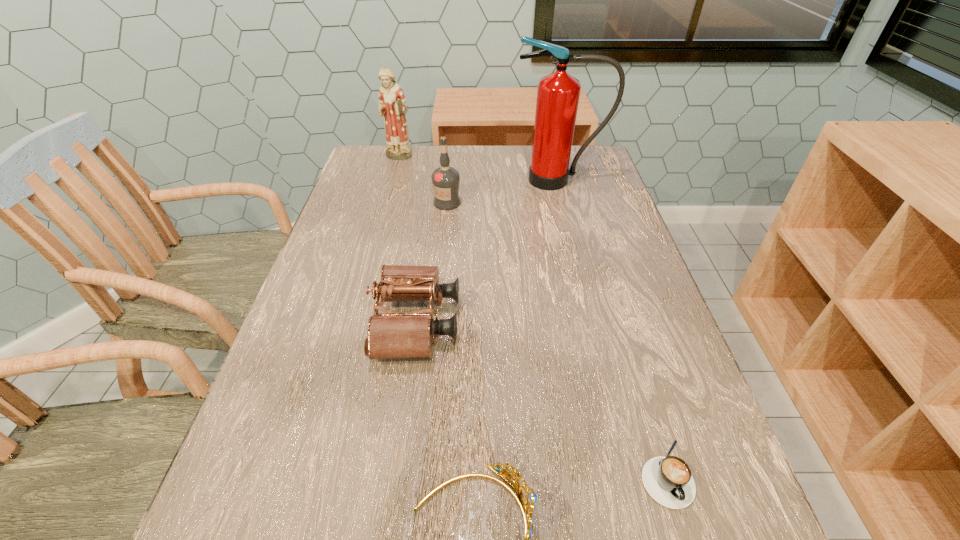
The image size is (960, 540). I want to click on vacant area situated 0.370m on the front label of the third farthest object, so (437, 310).

Locate an element on the screen. The width and height of the screenshot is (960, 540). free spot located through the eyepieces of the binoculars is located at coordinates (653, 323).

What are the coordinates of `fire extinguisher that is at the far edge` in the screenshot? It's located at (558, 93).

Identify the location of figurine positioned at the far edge. This screenshot has width=960, height=540. click(392, 103).

Locate an element on the screen. This screenshot has height=540, width=960. object that is at the left edge is located at coordinates (392, 103).

Identify the location of fire extinguisher present at the right edge. This screenshot has height=540, width=960. (558, 93).

Image resolution: width=960 pixels, height=540 pixels. In order to click on cappuccino that is at the right edge in this screenshot , I will do `click(668, 480)`.

The image size is (960, 540). In order to click on object that is positioned at the far left corner in this screenshot , I will do `click(392, 103)`.

Image resolution: width=960 pixels, height=540 pixels. In order to click on object at the far right corner in this screenshot , I will do `click(558, 93)`.

Identify the location of vacant space at the far edge of the desktop. This screenshot has height=540, width=960. (419, 152).